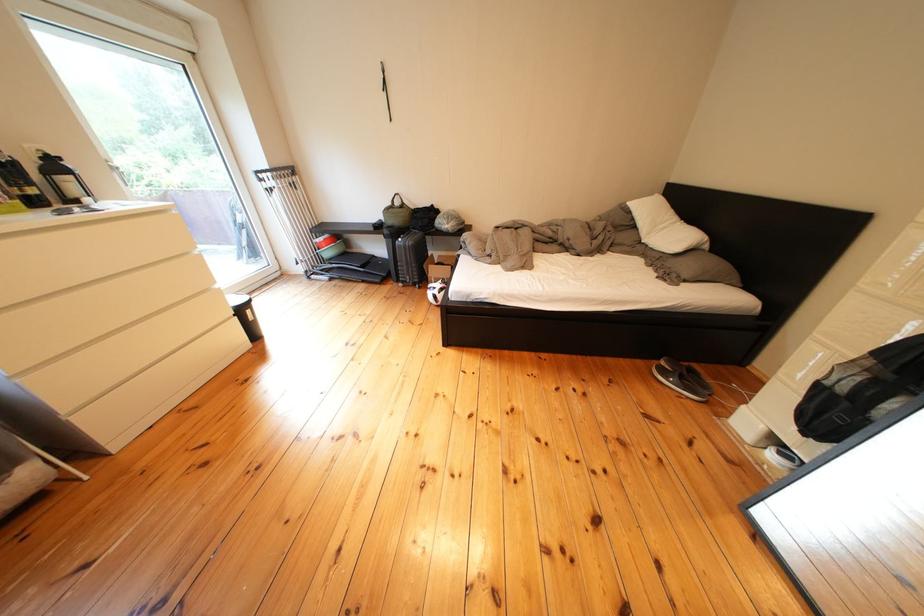
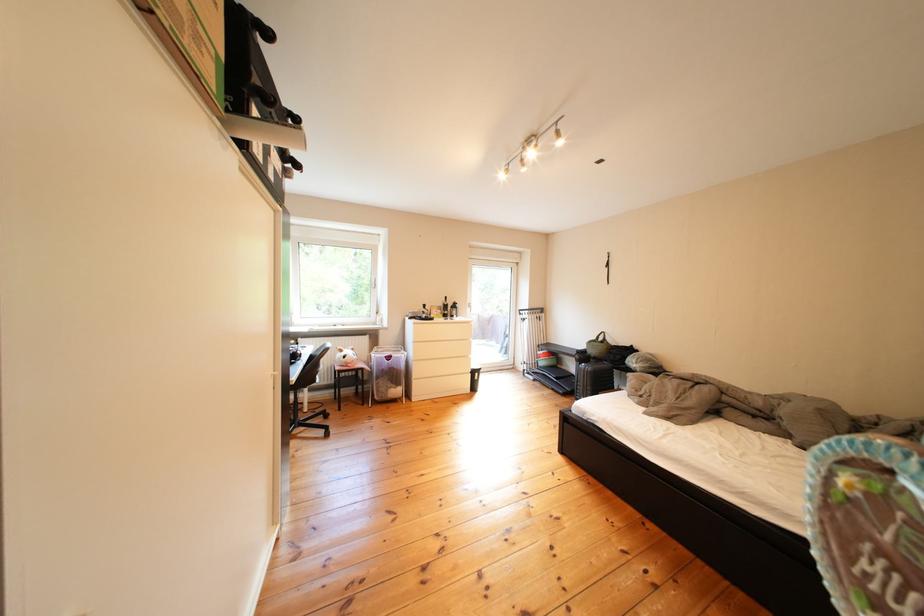
Find the pixel in the second image that matches (370,254) in the first image.

(578, 371)